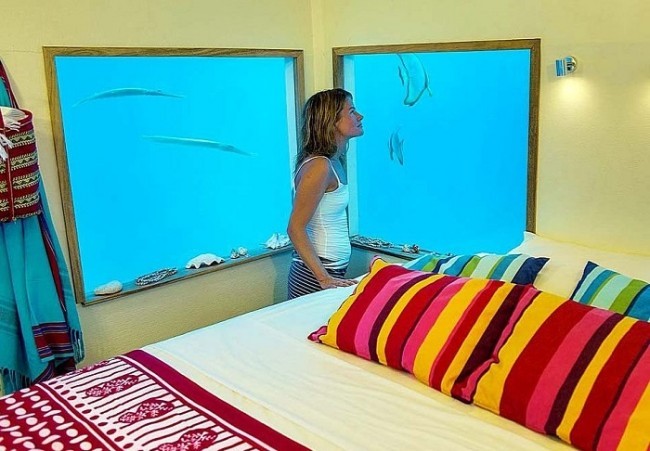
This screenshot has width=650, height=451. I want to click on white and red blanket, so click(177, 423).